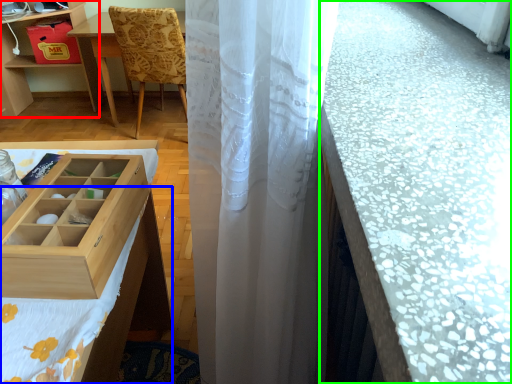
Question: Estimate the real-world distances between objects in this image. Which object is closer to table (highlighted by a red box), tablecloth (highlighted by a blue box) or counter top (highlighted by a green box)?

Choices:
 (A) tablecloth
 (B) counter top

Answer: (A)